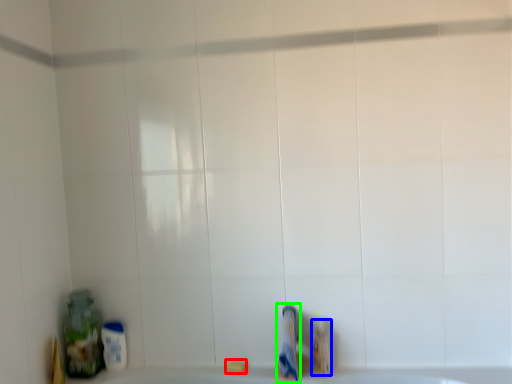
Question: Which object is the closest to the soap (highlighted by a red box)? Choose among these: toiletry (highlighted by a blue box) or toothpaste (highlighted by a green box).

Choices:
 (A) toiletry
 (B) toothpaste

Answer: (B)